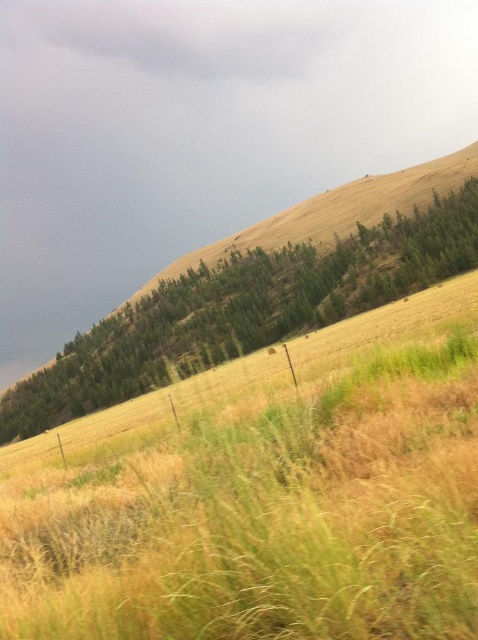
Question: Does dry grass at upper center appear on the right side of green leafy tree at upper center?

Choices:
 (A) no
 (B) yes

Answer: (B)

Question: Can you confirm if dry grass at upper center is bigger than green leafy tree at upper center?

Choices:
 (A) no
 (B) yes

Answer: (A)

Question: Among these objects, which one is nearest to the camera?

Choices:
 (A) green leafy tree at upper center
 (B) dry grass at upper center

Answer: (B)

Question: Does dry grass at upper center come in front of green leafy tree at upper center?

Choices:
 (A) no
 (B) yes

Answer: (B)

Question: Among these objects, which one is nearest to the camera?

Choices:
 (A) green leafy tree at upper center
 (B) dry grass at upper center

Answer: (B)